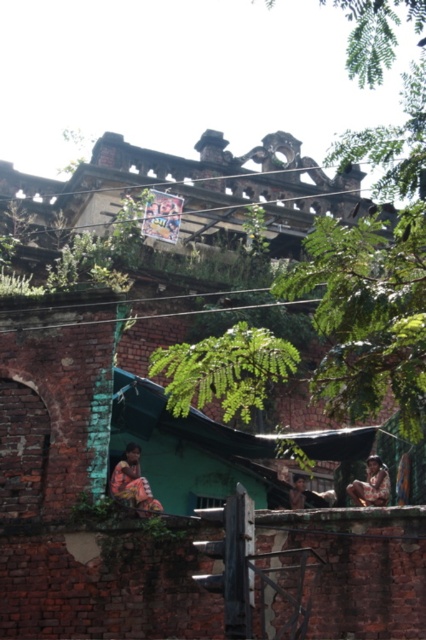
You are an urban explorer who wants to take a photo of the multicolored fabric at lower left and brown textured fabric at center. From the current position, which fabric should you adjust your camera angle to the right to capture?

The multicolored fabric at lower left is to the left of brown textured fabric at center, so to capture both, you should adjust your camera angle to the right to include the multicolored fabric at lower left which is on the left side.

You are standing in front of the old brick building and notice a green leafy tree at upper center and a brown textured fabric at center. Which object is nearer to you?

The green leafy tree at upper center is closer to the viewer than the brown textured fabric at center.

You are a city planner assessing the urban space. You need to determine if the green leafy tree at upper center can be safely pruned without damaging the brown textured fabric at center. Based on their sizes, what should you consider?

The green leafy tree at upper center is larger in size than the brown textured fabric at center, so pruning the tree might require caution to avoid the fabric.